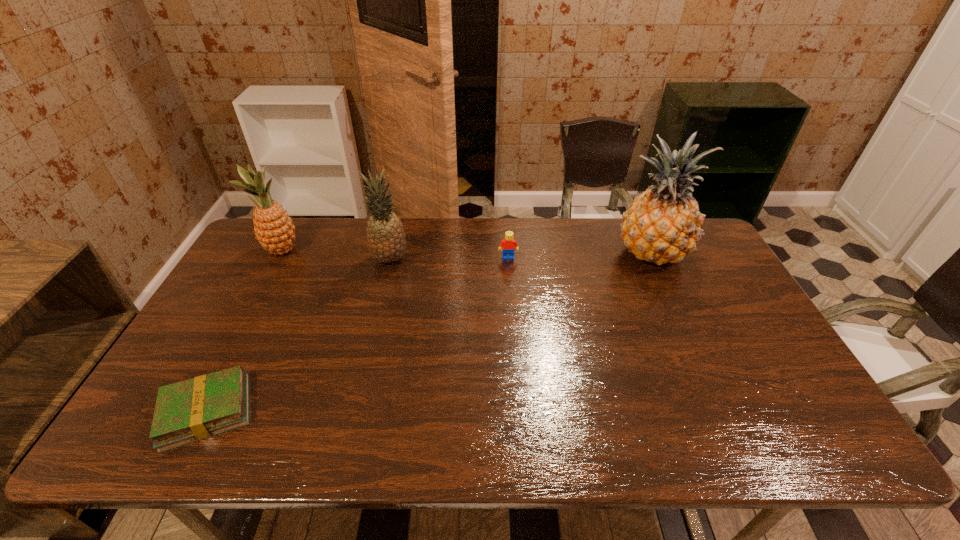
You are a GUI agent. You are given a task and a screenshot of the screen. Output one action in this format:
    pyautogui.click(x=<x>, y=<y>)
    Task: Click on the vacant point at the near edge
    The image size is (960, 540).
    Given the screenshot: What is the action you would take?
    pyautogui.click(x=334, y=420)

Locate an element on the screen. vacant space at the left edge is located at coordinates (196, 342).

In the image, there is a desktop. Where is `vacant space at the right edge`? The height and width of the screenshot is (540, 960). vacant space at the right edge is located at coordinates (730, 314).

This screenshot has height=540, width=960. In the image, there is a desktop. What are the coordinates of `vacant space at the far left corner` in the screenshot? It's located at (299, 232).

In order to click on free space at the near left corner of the desktop in this screenshot , I will do `click(140, 451)`.

This screenshot has height=540, width=960. I want to click on vacant space at the near right corner of the desktop, so click(x=787, y=449).

The height and width of the screenshot is (540, 960). What are the coordinates of `vacant area between the nearest object and the rightmost pineapple` in the screenshot? It's located at (429, 332).

The image size is (960, 540). Find the location of `empty space that is in between the second shortest object and the shortest object`. empty space that is in between the second shortest object and the shortest object is located at coordinates (357, 334).

Identify the location of free area in between the fourth object from left to right and the second pineapple from right to left. This screenshot has width=960, height=540. (449, 258).

Locate an element on the screen. Image resolution: width=960 pixels, height=540 pixels. free space between the nearest object and the rightmost object is located at coordinates (429, 332).